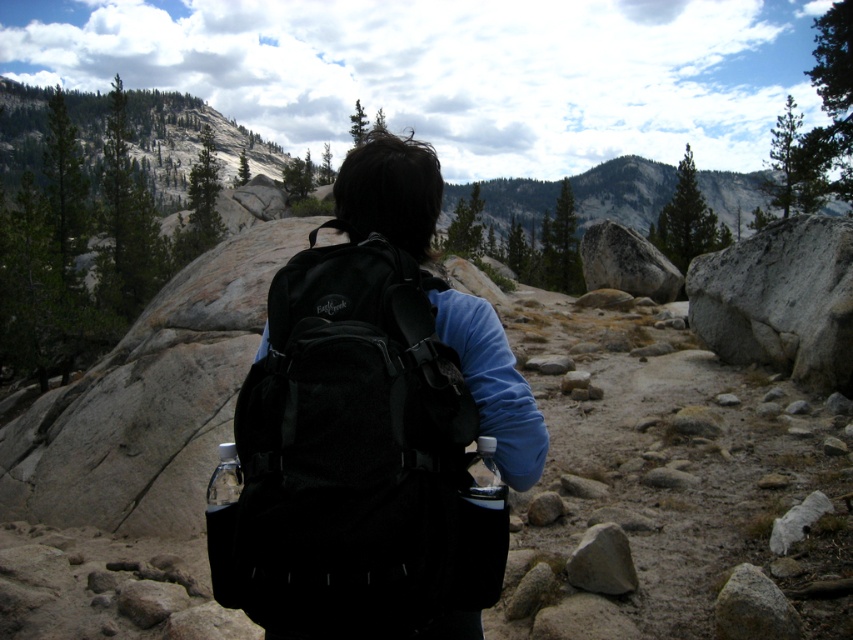
Find the location of a particular element. black mesh backpack at center is located at coordinates (357, 458).

Can you confirm if black mesh backpack at center is positioned to the left of gray/rough rock at center?

Indeed, black mesh backpack at center is positioned on the left side of gray/rough rock at center.

Between point (341, 525) and point (628, 572), which one is positioned behind?

Point (628, 572)

Locate an element on the screen. black mesh backpack at center is located at coordinates (357, 458).

How far apart are black mesh backpack at center and gray rock at lower right?

black mesh backpack at center is 2.54 meters from gray rock at lower right.

Does black mesh backpack at center appear on the right side of gray rock at lower right?

In fact, black mesh backpack at center is to the left of gray rock at lower right.

Does point (345, 310) come farther from viewer compared to point (721, 614)?

No, it is not.

I want to click on black mesh backpack at center, so click(x=357, y=458).

Between gray rock at lower right and gray/rough rock at center, which one appears on the right side from the viewer's perspective?

From the viewer's perspective, gray rock at lower right appears more on the right side.

Does gray rock at lower right appear on the right side of gray/rough rock at center?

Indeed, gray rock at lower right is positioned on the right side of gray/rough rock at center.

The image size is (853, 640). Find the location of `gray rock at lower right`. gray rock at lower right is located at coordinates (753, 608).

At what (x,y) coordinates should I click in order to perform the action: click on gray rock at lower right. Please return your answer as a coordinate pair (x, y). This screenshot has width=853, height=640. Looking at the image, I should click on (753, 608).